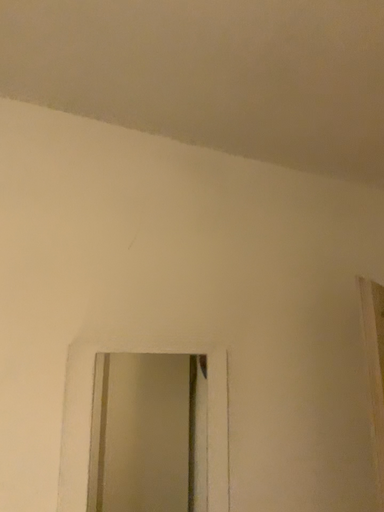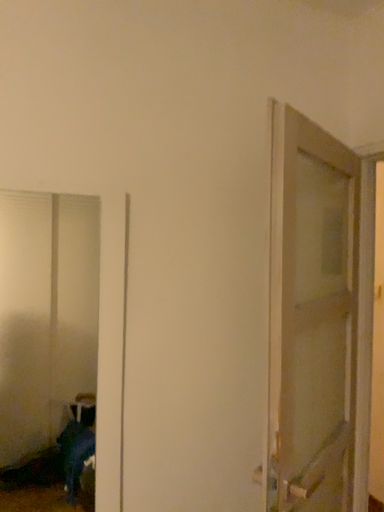
Question: Which way did the camera rotate in the video?

Choices:
 (A) rotated downward
 (B) rotated upward

Answer: (A)